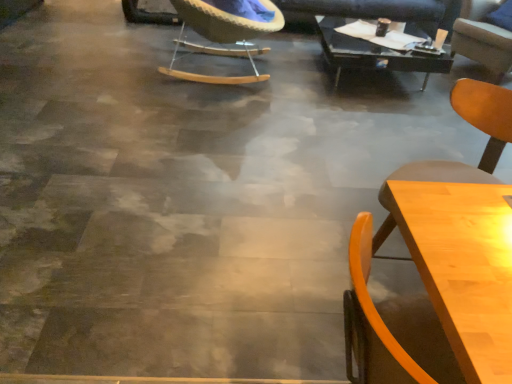
Question: From the image's perspective, is woven fabric chair at upper center, marked as the 3th chair in a right-to-left arrangement, beneath light wood chair at lower right, the 2th chair when ordered from right to left?

Choices:
 (A) yes
 (B) no

Answer: (B)

Question: Are woven fabric chair at upper center, marked as the 3th chair in a right-to-left arrangement, and light wood chair at lower right, arranged as the 3th chair when viewed from the back, far apart?

Choices:
 (A) no
 (B) yes

Answer: (B)

Question: Is woven fabric chair at upper center, which is counted as the second chair, starting from the front, not within light wood chair at lower right, positioned as the second chair in left-to-right order?

Choices:
 (A) no
 (B) yes

Answer: (B)

Question: Does woven fabric chair at upper center, which is counted as the second chair, starting from the front, turn towards light wood chair at lower right, arranged as the 3th chair when viewed from the back?

Choices:
 (A) no
 (B) yes

Answer: (A)

Question: Is woven fabric chair at upper center, the second chair when ordered from back to front, bigger than light wood chair at lower right, arranged as the 3th chair when viewed from the back?

Choices:
 (A) yes
 (B) no

Answer: (A)

Question: Relative to black glass table at upper center, which is counted as the first table, starting from the back, is light wood chair at lower right, positioned as the second chair in left-to-right order, in front or behind?

Choices:
 (A) behind
 (B) front

Answer: (B)

Question: From the image's perspective, is light wood chair at lower right, arranged as the 3th chair when viewed from the back, located above or below black glass table at upper center, placed as the second table when sorted from bottom to top?

Choices:
 (A) below
 (B) above

Answer: (A)

Question: Is light wood chair at lower right, positioned as the second chair in left-to-right order, taller or shorter than black glass table at upper center, marked as the 2th table in a front-to-back arrangement?

Choices:
 (A) tall
 (B) short

Answer: (A)

Question: In terms of size, does light wood chair at lower right, positioned as the second chair in left-to-right order, appear bigger or smaller than black glass table at upper center, which is counted as the first table, starting from the back?

Choices:
 (A) small
 (B) big

Answer: (A)

Question: From a real-world perspective, is black glass table at upper center, placed as the second table when sorted from bottom to top, positioned above or below light brown wood chair at upper right, which is counted as the 1th chair, starting from the right?

Choices:
 (A) above
 (B) below

Answer: (B)

Question: Based on their sizes in the image, would you say black glass table at upper center, placed as the second table when sorted from bottom to top, is bigger or smaller than light brown wood chair at upper right, the 3th chair positioned from the left?

Choices:
 (A) small
 (B) big

Answer: (A)

Question: Do you think black glass table at upper center, placed as the second table when sorted from bottom to top, is within light brown wood chair at upper right, the 3th chair positioned from the left, or outside of it?

Choices:
 (A) outside
 (B) inside

Answer: (A)

Question: Considering the positions of black glass table at upper center, the second table when ordered from left to right, and light brown wood chair at upper right, positioned as the third chair in front-to-back order, in the image, is black glass table at upper center, the second table when ordered from left to right, taller or shorter than light brown wood chair at upper right, positioned as the third chair in front-to-back order,?

Choices:
 (A) tall
 (B) short

Answer: (B)

Question: Is point (329, 49) positioned closer to the camera than point (456, 231)?

Choices:
 (A) farther
 (B) closer

Answer: (A)

Question: In terms of height, does black glass table at upper center, the second table when ordered from left to right, look taller or shorter compared to wooden table at lower right, which is the second table from back to front?

Choices:
 (A) tall
 (B) short

Answer: (B)